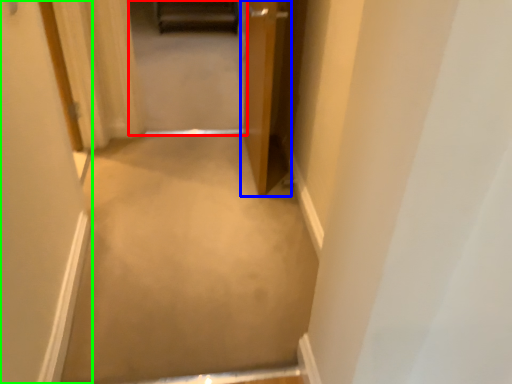
Question: Which object is positioned closest to passage (highlighted by a red box)? Select from door (highlighted by a blue box) and door (highlighted by a green box).

Choices:
 (A) door
 (B) door

Answer: (A)